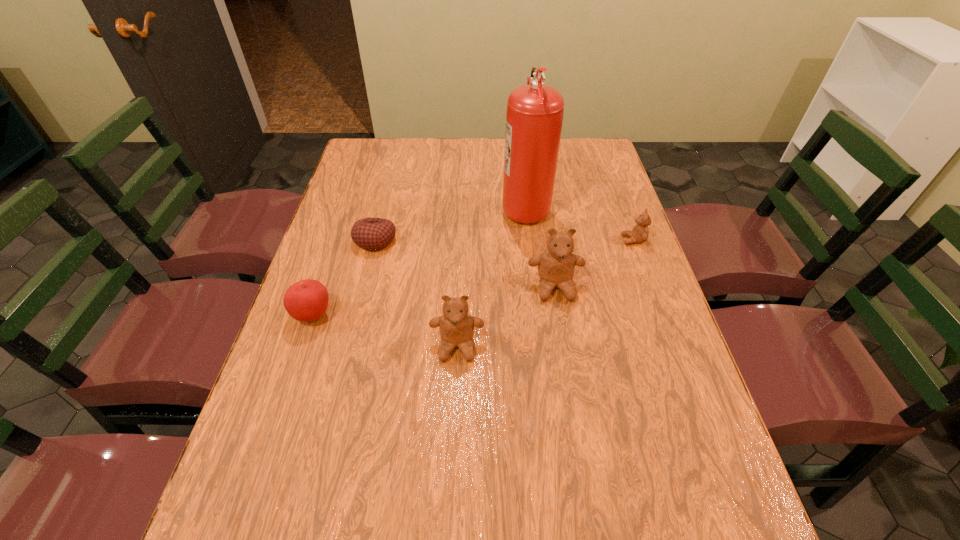
Locate an element on the screen. The image size is (960, 540). object located at the right edge is located at coordinates (639, 234).

At what (x,y) coordinates should I click in order to perform the action: click on vacant space at the far edge. Please return your answer as a coordinate pair (x, y). Image resolution: width=960 pixels, height=540 pixels. Looking at the image, I should click on (443, 152).

You are a GUI agent. You are given a task and a screenshot of the screen. Output one action in this format:
    pyautogui.click(x=<x>, y=<y>)
    Task: Click on the vacant area at the left edge of the desktop
    This screenshot has width=960, height=540.
    Given the screenshot: What is the action you would take?
    pyautogui.click(x=315, y=439)

Find the location of a particular element. Image resolution: width=960 pixels, height=540 pixels. free space at the right edge is located at coordinates (605, 207).

Identify the location of vacant region at the far left corner of the desktop. (354, 155).

Locate an element on the screen. This screenshot has width=960, height=540. free point between the fourth object from right to left and the tallest object is located at coordinates (491, 276).

I want to click on free space between the shortest teddy bear and the beanbag, so click(504, 240).

Where is `blank region between the rightmost teddy bear and the second teddy bear from left to right`? The width and height of the screenshot is (960, 540). blank region between the rightmost teddy bear and the second teddy bear from left to right is located at coordinates (594, 264).

Locate an element on the screen. free space between the apple and the second farthest teddy bear is located at coordinates (434, 301).

Locate an element on the screen. The width and height of the screenshot is (960, 540). vacant area that lies between the apple and the rightmost teddy bear is located at coordinates (473, 278).